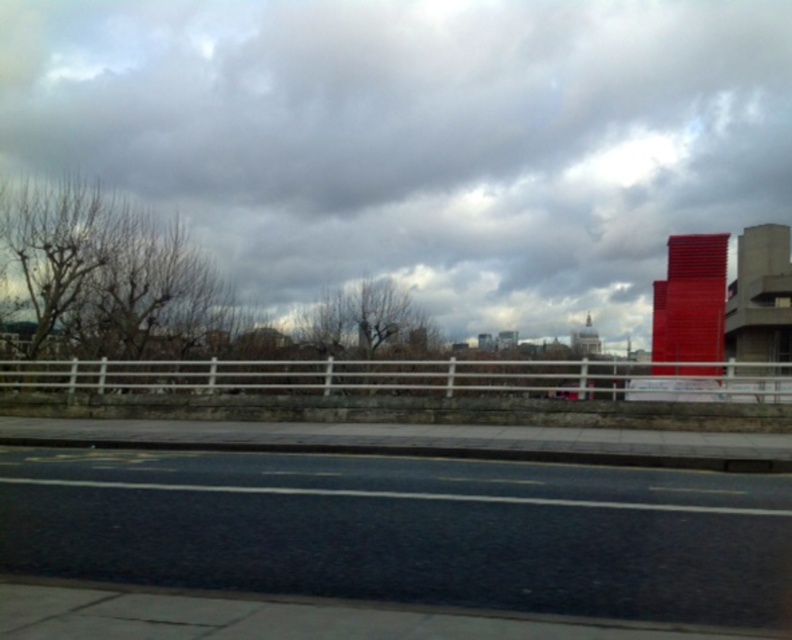
Question: From the image, what is the correct spatial relationship of cloudy sky at upper center in relation to black asphalt highway at lower center?

Choices:
 (A) right
 (B) left

Answer: (A)

Question: Among these points, which one is farthest from the camera?

Choices:
 (A) (625, 60)
 (B) (341, 515)

Answer: (A)

Question: Does cloudy sky at upper center have a smaller size compared to black asphalt highway at lower center?

Choices:
 (A) yes
 (B) no

Answer: (B)

Question: In this image, where is cloudy sky at upper center located relative to black asphalt highway at lower center?

Choices:
 (A) below
 (B) above

Answer: (B)

Question: Among these points, which one is farthest from the camera?

Choices:
 (A) (419, 525)
 (B) (668, 138)

Answer: (B)